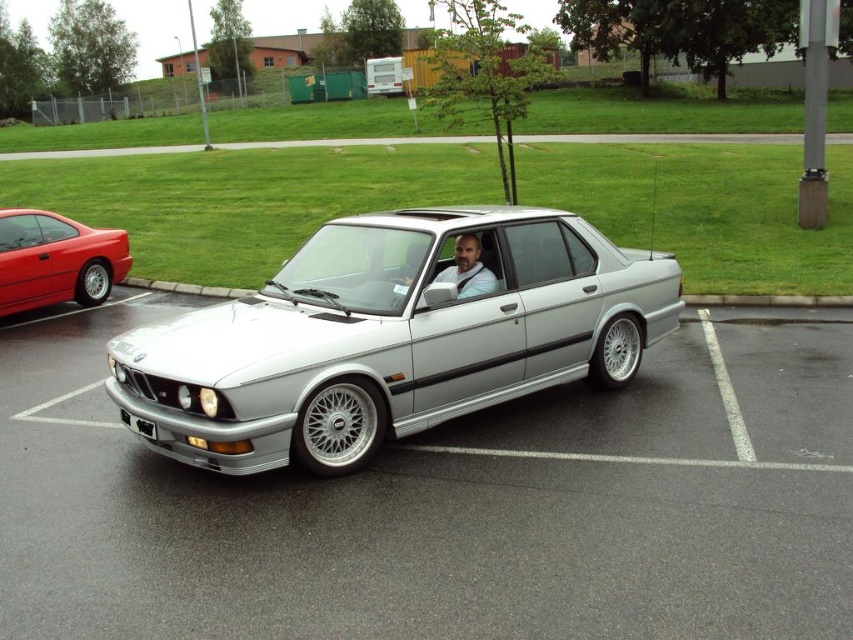
Question: Considering the relative positions of silver metallic car at center and black plastic license plate at front in the image provided, where is silver metallic car at center located with respect to black plastic license plate at front?

Choices:
 (A) left
 (B) right

Answer: (B)

Question: Can you confirm if bearded man in shirt at center is wider than black plastic license plate at front?

Choices:
 (A) yes
 (B) no

Answer: (A)

Question: Does satin silver car at center appear under black plastic license plate at front?

Choices:
 (A) yes
 (B) no

Answer: (B)

Question: Which is farther from the bearded man in shirt at center?

Choices:
 (A) silver metallic car at center
 (B) satin silver car at center
 (C) black plastic license plate at front

Answer: (C)

Question: Which point is farther to the camera?

Choices:
 (A) satin silver car at center
 (B) black plastic license plate at front

Answer: (B)

Question: Which object is positioned farthest from the black plastic license plate at front?

Choices:
 (A) bearded man in shirt at center
 (B) satin silver car at center
 (C) silver metallic car at center

Answer: (A)